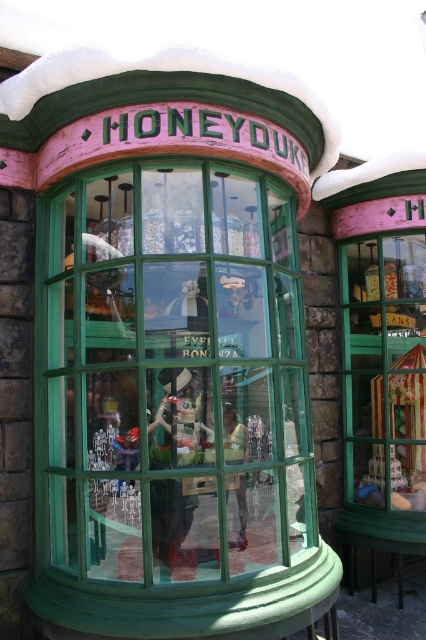
Question: Does green glass window at center have a smaller size compared to striped fabric tent at right?

Choices:
 (A) yes
 (B) no

Answer: (B)

Question: From the image, what is the correct spatial relationship of green glass window at center in relation to striped fabric tent at right?

Choices:
 (A) below
 (B) above

Answer: (B)

Question: Among these objects, which one is nearest to the camera?

Choices:
 (A) striped fabric tent at right
 (B) green glass window at center

Answer: (B)

Question: Does green glass window at center appear on the left side of striped fabric tent at right?

Choices:
 (A) yes
 (B) no

Answer: (A)

Question: Which point is closer to the camera?

Choices:
 (A) striped fabric tent at right
 (B) green glass window at center

Answer: (B)